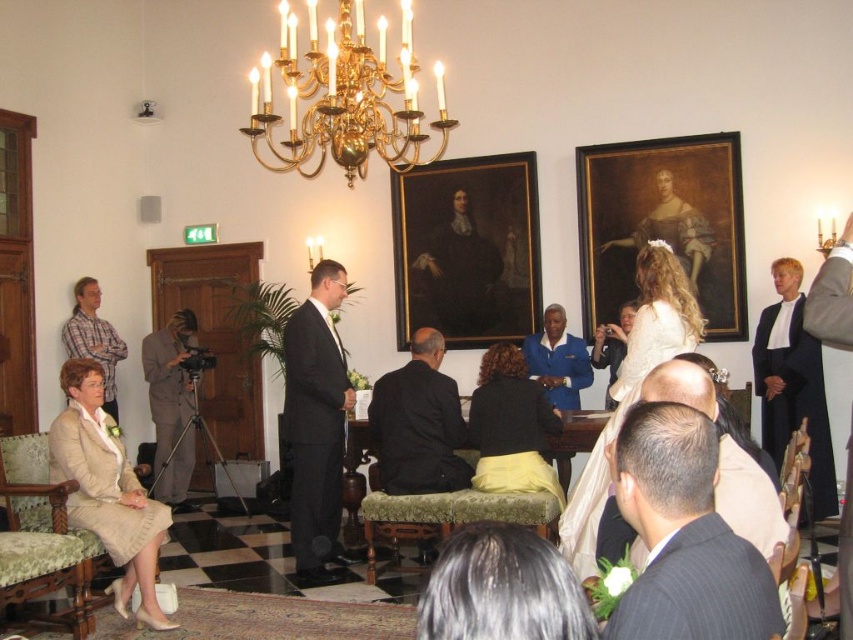
You are a photographer attending a wedding and need to capture the gold polished chandelier at upper center and the brown fabric camera at left in your shot. Which object should you focus on first if you want to highlight the larger one?

The gold polished chandelier at upper center is bigger than the brown fabric camera at left, so you should focus on the gold polished chandelier at upper center first to highlight its size.

You are a photographer at the wedding. You need to position your brown fabric camera at left to capture the gold polished chandelier at upper center. Since the chandelier is taller than the camera, how should you adjust your camera angle to ensure the entire chandelier is in frame?

The gold polished chandelier at upper center is taller than the brown fabric camera at left. To capture the entire chandelier, you should position the camera lower and tilt the lens upward to account for the chandelier being taller.

From the picture: You are a photographer at the event and need to position your brown fabric camera at left to capture the gold polished chandelier at upper center. Based on their positions, which direction should you point your camera to frame the chandelier properly?

The gold polished chandelier at upper center is to the right of the brown fabric camera at left, so you should point the camera to the right to frame the chandelier properly.